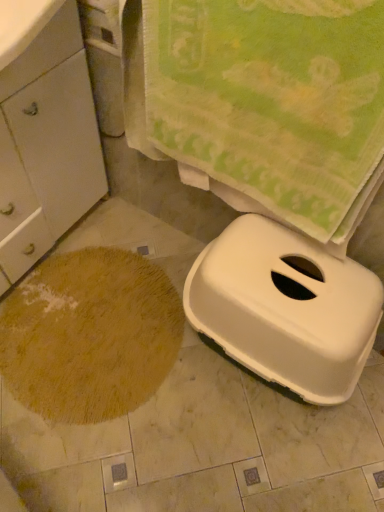
Question: Can you confirm if white plastic litter box at lower right is smaller than white matte cabinet at left?

Choices:
 (A) no
 (B) yes

Answer: (B)

Question: Considering the relative sizes of white plastic litter box at lower right and white matte cabinet at left in the image provided, is white plastic litter box at lower right thinner than white matte cabinet at left?

Choices:
 (A) yes
 (B) no

Answer: (B)

Question: Can you see white plastic litter box at lower right touching white matte cabinet at left?

Choices:
 (A) no
 (B) yes

Answer: (A)

Question: Is white plastic litter box at lower right at the left side of white matte cabinet at left?

Choices:
 (A) no
 (B) yes

Answer: (A)

Question: Does white plastic litter box at lower right have a greater height compared to white matte cabinet at left?

Choices:
 (A) yes
 (B) no

Answer: (B)

Question: From the image's perspective, is white matte cabinet at left positioned above or below brown shaggy rug at lower left?

Choices:
 (A) below
 (B) above

Answer: (B)

Question: Does point (34, 97) appear closer or farther from the camera than point (67, 336)?

Choices:
 (A) closer
 (B) farther

Answer: (A)

Question: Considering the relative positions of white matte cabinet at left and brown shaggy rug at lower left in the image provided, is white matte cabinet at left to the left or to the right of brown shaggy rug at lower left?

Choices:
 (A) right
 (B) left

Answer: (B)

Question: Considering the positions of white matte cabinet at left and brown shaggy rug at lower left in the image, is white matte cabinet at left taller or shorter than brown shaggy rug at lower left?

Choices:
 (A) tall
 (B) short

Answer: (A)

Question: Does point (11, 390) appear closer or farther from the camera than point (233, 292)?

Choices:
 (A) closer
 (B) farther

Answer: (B)

Question: From their relative heights in the image, would you say brown shaggy rug at lower left is taller or shorter than white plastic litter box at lower right?

Choices:
 (A) tall
 (B) short

Answer: (B)

Question: From a real-world perspective, is brown shaggy rug at lower left physically located above or below white plastic litter box at lower right?

Choices:
 (A) below
 (B) above

Answer: (A)

Question: Is brown shaggy rug at lower left in front of or behind white plastic litter box at lower right in the image?

Choices:
 (A) behind
 (B) front

Answer: (A)

Question: Considering the relative positions of brown shaggy rug at lower left and green textured towel at upper center in the image provided, is brown shaggy rug at lower left to the left or to the right of green textured towel at upper center?

Choices:
 (A) left
 (B) right

Answer: (A)

Question: From a real-world perspective, relative to green textured towel at upper center, is brown shaggy rug at lower left vertically above or below?

Choices:
 (A) above
 (B) below

Answer: (B)